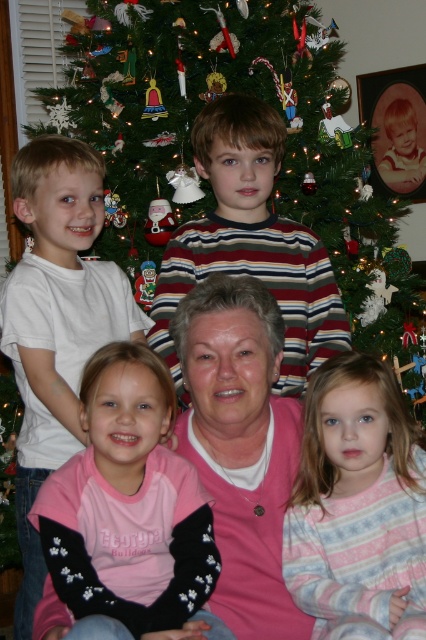
Does green textured christmas tree at center appear over pink striped pajamas at lower right?

Yes.

Describe the element at coordinates (230, 99) in the screenshot. The width and height of the screenshot is (426, 640). I see `green textured christmas tree at center` at that location.

Find the location of a particular element. green textured christmas tree at center is located at coordinates pyautogui.click(x=230, y=99).

Between point (198, 22) and point (178, 600), which one is positioned behind?

The point (198, 22) is behind.

Can you confirm if green textured christmas tree at center is positioned to the left of pink fleece sweater at lower left?

In fact, green textured christmas tree at center is to the right of pink fleece sweater at lower left.

Is point (342, 310) positioned in front of point (207, 586)?

No, it is not.

Where is `green textured christmas tree at center`? green textured christmas tree at center is located at coordinates (230, 99).

The image size is (426, 640). In order to click on green textured christmas tree at center in this screenshot , I will do pos(230,99).

Where is `green textured christmas tree at center`? The height and width of the screenshot is (640, 426). green textured christmas tree at center is located at coordinates (230, 99).